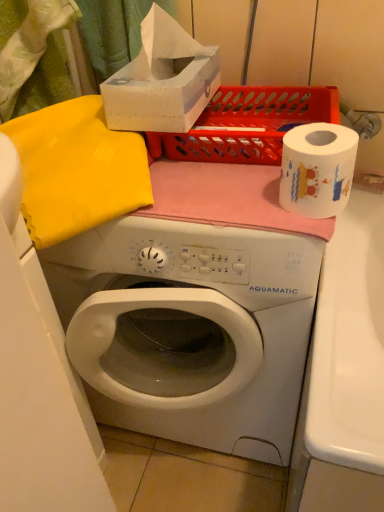
Locate an element on the screen. blank space to the left of white paper at right is located at coordinates (216, 201).